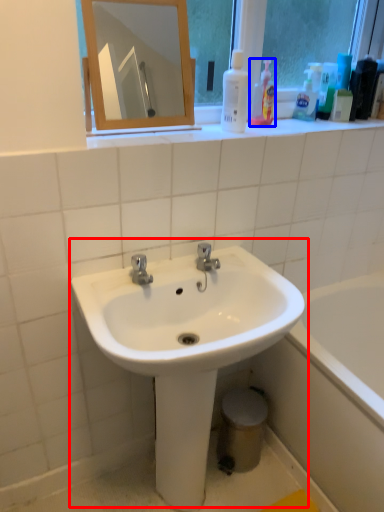
Question: Among these objects, which one is farthest to the camera, sink (highlighted by a red box) or cleaning product (highlighted by a blue box)?

Choices:
 (A) sink
 (B) cleaning product

Answer: (B)